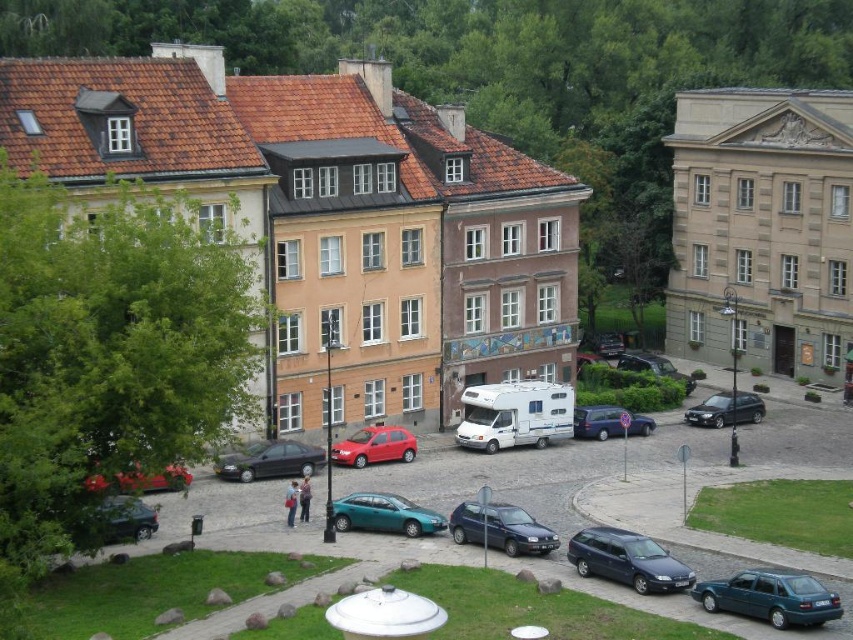
Question: Which is farther from the metallic blue station wagon at lower right?

Choices:
 (A) metallic blue hatchback at lower right
 (B) shiny black car at lower left
 (C) shiny red car at center

Answer: (C)

Question: Which of these objects is positioned closest to the metallic silver car at center?

Choices:
 (A) matte black sedan at center
 (B) shiny red car at lower left
 (C) teal metallic hatchback at center

Answer: (A)

Question: Which point is closer to the camera taking this photo?

Choices:
 (A) (624, 358)
 (B) (537, 531)
 (C) (723, 403)

Answer: (B)

Question: Can you confirm if black metallic sedan at center right is positioned above metallic blue van at center?

Choices:
 (A) yes
 (B) no

Answer: (A)

Question: Can you confirm if black metallic sedan at center right is positioned to the left of metallic silver car at center?

Choices:
 (A) yes
 (B) no

Answer: (B)

Question: Is shiny black car at lower left to the left of shiny red car at lower left from the viewer's perspective?

Choices:
 (A) no
 (B) yes

Answer: (B)